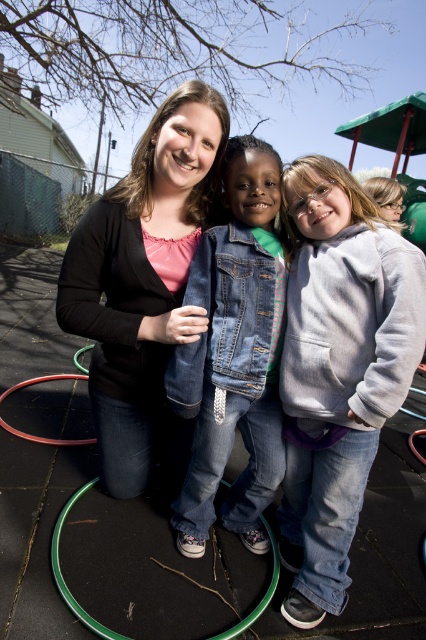
You are standing in the park and see two points marked in the image. Which point is nearer to you, point (77, 241) or point (88, 442)?

Point (77, 241) is closer to the viewer than point (88, 442).

You are standing in the playground and see the denim jacket at center and the green rubber hula hoop at lower center. Which object is positioned to the right side?

The denim jacket at center is to the right of the green rubber hula hoop at lower center.